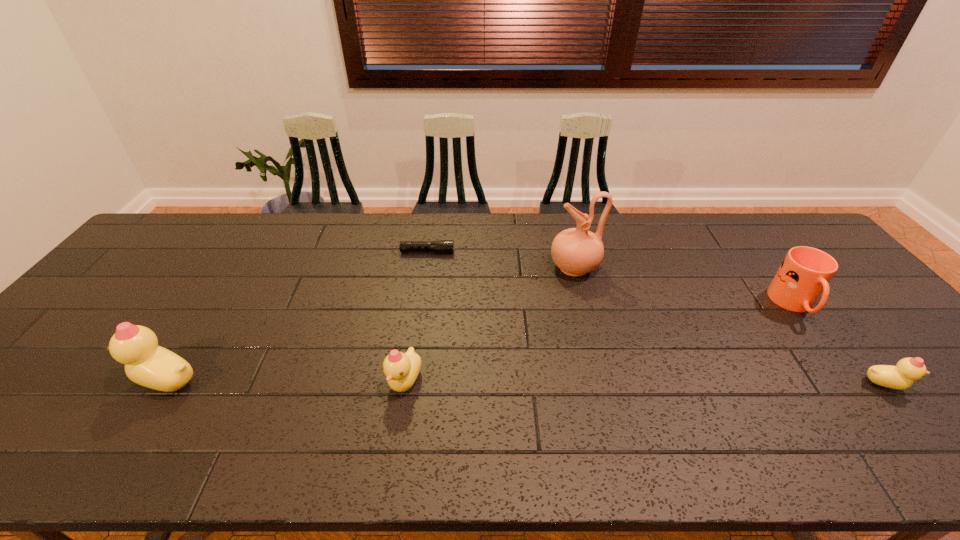
Identify the location of spot to insert another duckling for uniform distribution. (644, 383).